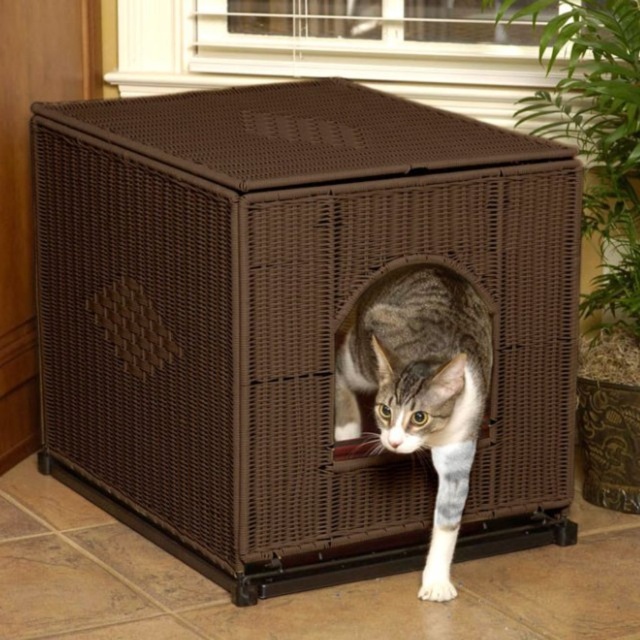
You are a robotic vacuum cleaner positioned at point A. You need to move to point B, which is directly behind the brown wicker crate at center. What direction should you move in to avoid hitting the crate?

The brown wicker crate at center is located at point (291, 320). To move to point B behind it, you should move in the direction away from the crate along the Y axis.

You are a cat owner who wants to place a new toy between the brown wicker crate at center and the tabby fur cat at center. Where should you put the toy so it is closer to the crate than the cat?

The toy should be placed closer to the brown wicker crate at center than the tabby fur cat at center, so position it between them but nearer to the crate side.